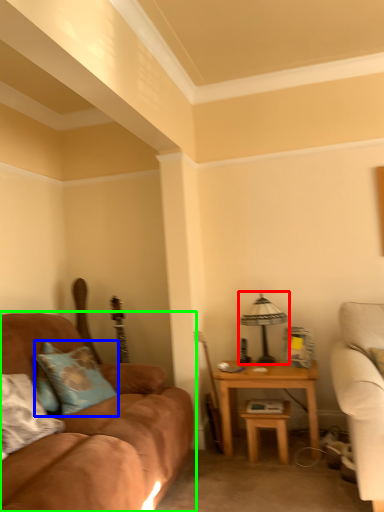
Question: Considering the real-world distances, which object is farthest from table lamp (highlighted by a red box)? pillow (highlighted by a blue box) or studio couch (highlighted by a green box)?

Choices:
 (A) pillow
 (B) studio couch

Answer: (A)